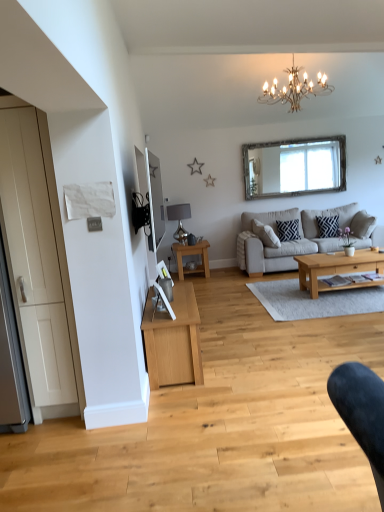
Question: Could you tell me if white matte door at left is turned towards light brown wooden coffee table at center, which appears as the first coffee table when viewed from the right?

Choices:
 (A) yes
 (B) no

Answer: (B)

Question: Does white matte door at left have a greater width compared to light brown wooden coffee table at center, arranged as the 2th coffee table when viewed from the back?

Choices:
 (A) no
 (B) yes

Answer: (B)

Question: Does white matte door at left have a larger size compared to light brown wooden coffee table at center, the 2th coffee table viewed from the left?

Choices:
 (A) yes
 (B) no

Answer: (A)

Question: Is white matte door at left outside of light brown wooden coffee table at center, the 2th coffee table viewed from the left?

Choices:
 (A) no
 (B) yes

Answer: (B)

Question: Is light brown wooden coffee table at center, arranged as the 2th coffee table when viewed from the back, completely or partially inside white matte door at left?

Choices:
 (A) yes
 (B) no

Answer: (B)

Question: Choose the correct answer: Is light brown wooden coffee table at center, which ranks as the first coffee table in front-to-back order, inside light wood/texture coffee table at center, the 2th coffee table when ordered from front to back, or outside it?

Choices:
 (A) outside
 (B) inside

Answer: (A)

Question: Based on their positions, is light brown wooden coffee table at center, which ranks as the first coffee table in front-to-back order, located to the left or right of light wood/texture coffee table at center, the 2th coffee table in the right-to-left sequence?

Choices:
 (A) right
 (B) left

Answer: (A)

Question: Considering the positions of light brown wooden coffee table at center, the 2th coffee table viewed from the left, and light wood/texture coffee table at center, the first coffee table in the left-to-right sequence, in the image, is light brown wooden coffee table at center, the 2th coffee table viewed from the left, taller or shorter than light wood/texture coffee table at center, the first coffee table in the left-to-right sequence,?

Choices:
 (A) short
 (B) tall

Answer: (A)

Question: In the image, is light brown wooden coffee table at center, arranged as the 2th coffee table when viewed from the back, positioned in front of or behind light wood/texture coffee table at center, which is counted as the first coffee table, starting from the back?

Choices:
 (A) front
 (B) behind

Answer: (A)

Question: From the image's perspective, relative to gold metallic chandelier at upper center, is matte silver lamp at center-left above or below?

Choices:
 (A) below
 (B) above

Answer: (A)

Question: Considering the positions of matte silver lamp at center-left and gold metallic chandelier at upper center in the image, is matte silver lamp at center-left wider or thinner than gold metallic chandelier at upper center?

Choices:
 (A) thin
 (B) wide

Answer: (A)

Question: Relative to gold metallic chandelier at upper center, is matte silver lamp at center-left in front or behind?

Choices:
 (A) front
 (B) behind

Answer: (B)

Question: Considering the positions of matte silver lamp at center-left and gold metallic chandelier at upper center in the image, is matte silver lamp at center-left taller or shorter than gold metallic chandelier at upper center?

Choices:
 (A) tall
 (B) short

Answer: (B)

Question: In terms of height, does silver-framed mirror at upper center, the 2th mirror when ordered from bottom to top, look taller or shorter compared to gold metallic chandelier at upper center?

Choices:
 (A) tall
 (B) short

Answer: (A)

Question: Is point (316, 145) positioned closer to the camera than point (291, 91)?

Choices:
 (A) farther
 (B) closer

Answer: (A)